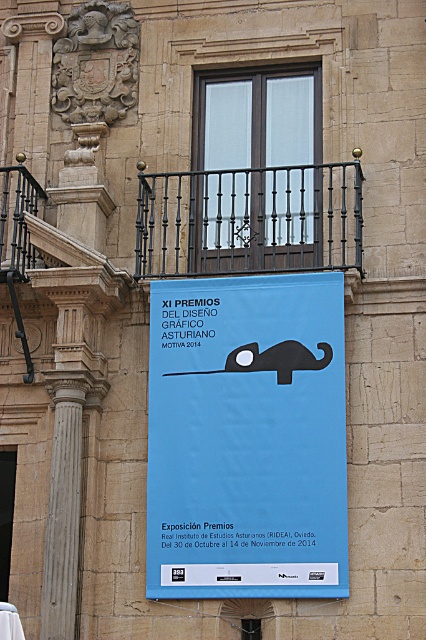
You are an art student analyzing the historic building scene. You notice the blue paper poster at center and the black wrought iron at upper center. Which object has a greater height in the image?

The blue paper poster at center is much taller than the black wrought iron at upper center, so the blue paper poster at center has a greater height.

What are the coordinates of the blue paper poster at center?

The blue paper poster at center is located at point (247, 436).